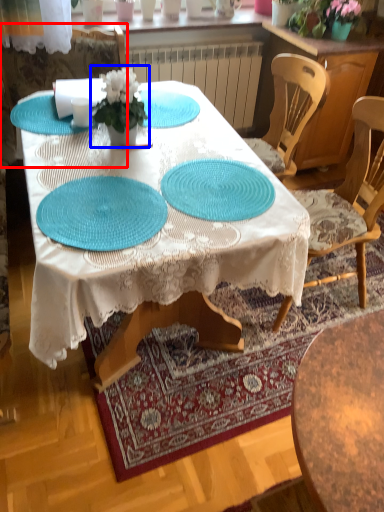
Question: Among these objects, which one is farthest to the camera, chair (highlighted by a red box) or houseplant (highlighted by a blue box)?

Choices:
 (A) chair
 (B) houseplant

Answer: (A)